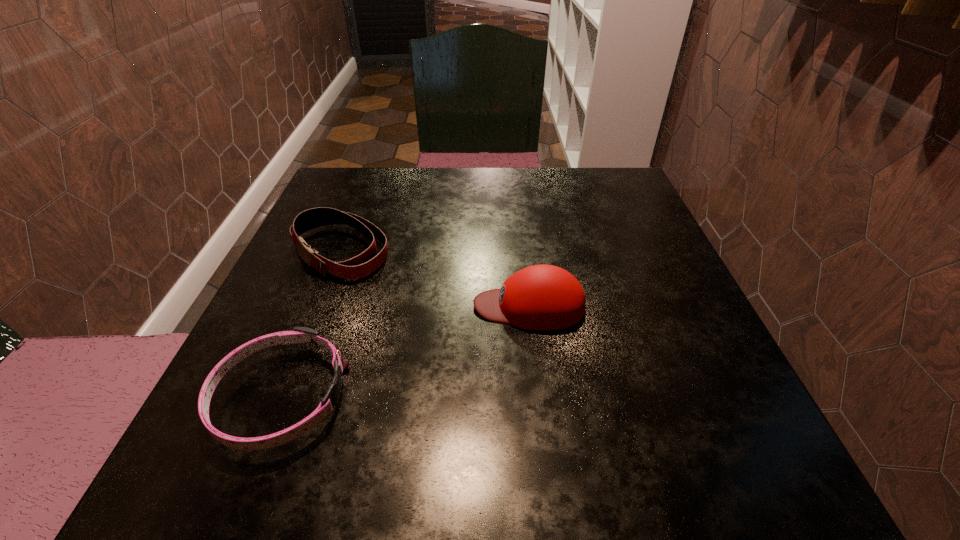
I want to click on vacant point located between the baseball cap and the taller dog collar, so click(x=435, y=279).

At what (x,y) coordinates should I click in order to perform the action: click on free spot between the rightmost object and the farther dog collar. Please return your answer as a coordinate pair (x, y). The width and height of the screenshot is (960, 540). Looking at the image, I should click on (435, 279).

Locate an element on the screen. vacant point located between the farthest object and the shortest object is located at coordinates (310, 324).

Find the location of a particular element. free spot between the nearer dog collar and the farther dog collar is located at coordinates (310, 324).

Locate an element on the screen. vacant point located between the nearer dog collar and the second nearest object is located at coordinates (405, 352).

Identify the location of vacant point located between the nearest object and the farther dog collar. The image size is (960, 540). (310, 324).

In order to click on free space between the farther dog collar and the baseball cap in this screenshot , I will do `click(435, 279)`.

This screenshot has width=960, height=540. In order to click on unoccupied position between the farthest object and the nearer dog collar in this screenshot , I will do `click(310, 324)`.

The width and height of the screenshot is (960, 540). Identify the location of free space between the nearest object and the rightmost object. (405, 352).

Find the location of a particular element. This screenshot has width=960, height=540. vacant space in between the farther dog collar and the nearest object is located at coordinates (310, 324).